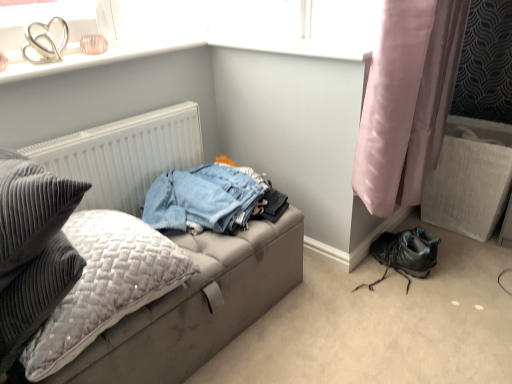
Locate an element on the screen. The height and width of the screenshot is (384, 512). vacant area that is situated to the right of matte black shoe at lower right is located at coordinates (452, 287).